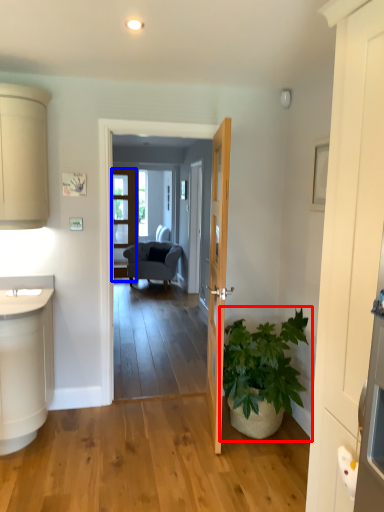
Question: Which of the following is the closest to the observer, houseplant (highlighted by a red box) or screen door (highlighted by a blue box)?

Choices:
 (A) houseplant
 (B) screen door

Answer: (A)